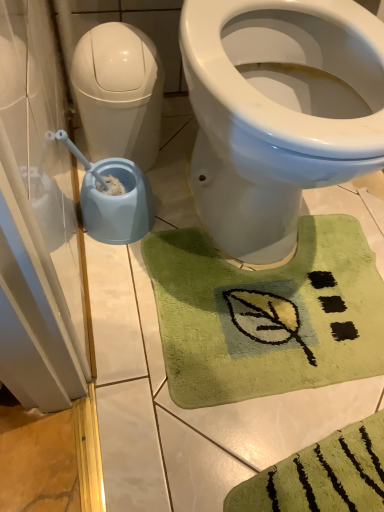
Question: From the image's perspective, is transparent plastic screen door at left over blue plastic bidet at left?

Choices:
 (A) yes
 (B) no

Answer: (B)

Question: Does transparent plastic screen door at left have a lesser height compared to blue plastic bidet at left?

Choices:
 (A) no
 (B) yes

Answer: (B)

Question: Could you tell me if transparent plastic screen door at left is facing blue plastic bidet at left?

Choices:
 (A) yes
 (B) no

Answer: (B)

Question: Can we say transparent plastic screen door at left lies outside blue plastic bidet at left?

Choices:
 (A) yes
 (B) no

Answer: (A)

Question: From the image's perspective, does transparent plastic screen door at left appear lower than blue plastic bidet at left?

Choices:
 (A) yes
 (B) no

Answer: (A)

Question: Is transparent plastic screen door at left to the right of blue plastic bidet at left from the viewer's perspective?

Choices:
 (A) no
 (B) yes

Answer: (A)

Question: Is green plush bath mat at lower center completely or partially inside white glossy water tank at left?

Choices:
 (A) no
 (B) yes

Answer: (A)

Question: Would you consider white glossy water tank at left to be distant from green plush bath mat at lower center?

Choices:
 (A) yes
 (B) no

Answer: (B)

Question: Is white glossy water tank at left beside green plush bath mat at lower center?

Choices:
 (A) yes
 (B) no

Answer: (B)

Question: Can we say white glossy water tank at left lies outside green plush bath mat at lower center?

Choices:
 (A) no
 (B) yes

Answer: (B)

Question: Is white glossy water tank at left facing towards green plush bath mat at lower center?

Choices:
 (A) yes
 (B) no

Answer: (B)

Question: Can you confirm if white glossy water tank at left is wider than green plush bath mat at lower center?

Choices:
 (A) no
 (B) yes

Answer: (A)

Question: Is green plush bath mat at lower center turned away from blue plastic bidet at left?

Choices:
 (A) yes
 (B) no

Answer: (A)